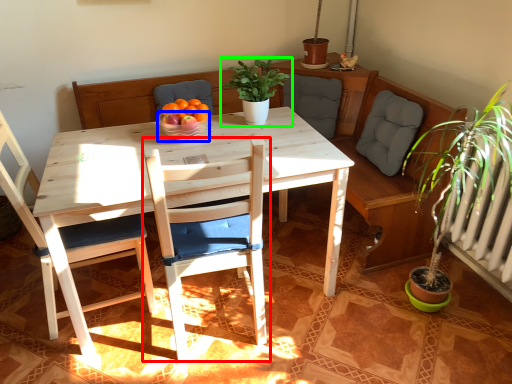
Question: Which object is positioned farthest from chair (highlighted by a red box)? Select from glass bowl (highlighted by a blue box) and houseplant (highlighted by a green box).

Choices:
 (A) glass bowl
 (B) houseplant

Answer: (B)